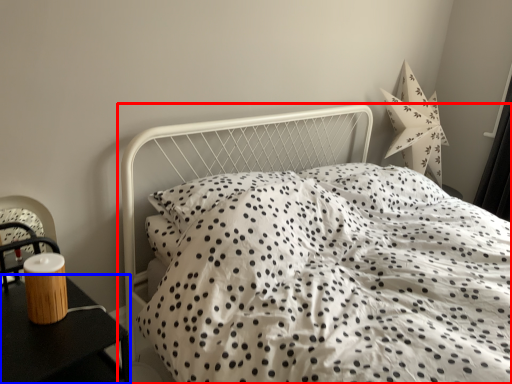
Question: Which object appears farthest to the camera in this image, bed (highlighted by a red box) or nightstand (highlighted by a blue box)?

Choices:
 (A) bed
 (B) nightstand

Answer: (B)